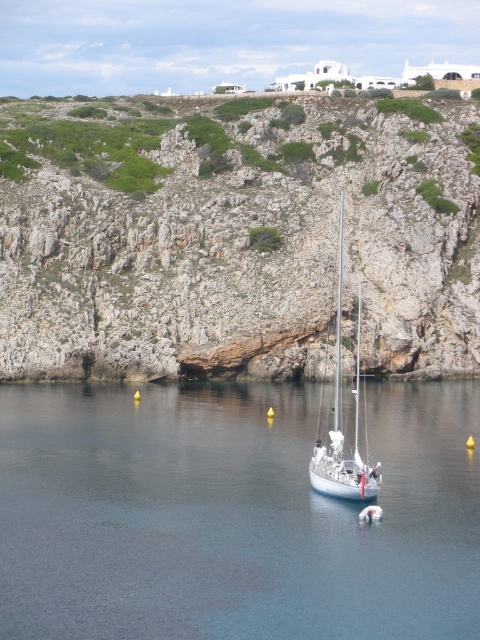
Is clear blue water at center wider than white glossy sailboat at center?

Yes.

Between clear blue water at center and white glossy sailboat at center, which one has more height?

A: With more height is white glossy sailboat at center.

Locate an element on the screen. The width and height of the screenshot is (480, 640). clear blue water at center is located at coordinates (232, 515).

Who is higher up, rocky cliff at center or white glossy sailboat at center?

rocky cliff at center is higher up.

Does rocky cliff at center come behind white glossy sailboat at center?

Yes, rocky cliff at center is behind white glossy sailboat at center.

You are a GUI agent. You are given a task and a screenshot of the screen. Output one action in this format:
    pyautogui.click(x=<x>, y=<y>)
    Task: Click on the rocky cliff at center
    This screenshot has width=480, height=640.
    Given the screenshot: What is the action you would take?
    pyautogui.click(x=236, y=234)

Can you confirm if rocky cliff at center is positioned to the right of clear blue water at center?

No, rocky cliff at center is not to the right of clear blue water at center.

Is point (214, 236) behind point (55, 636)?

Yes, point (214, 236) is behind point (55, 636).

Identify the location of rocky cliff at center. (236, 234).